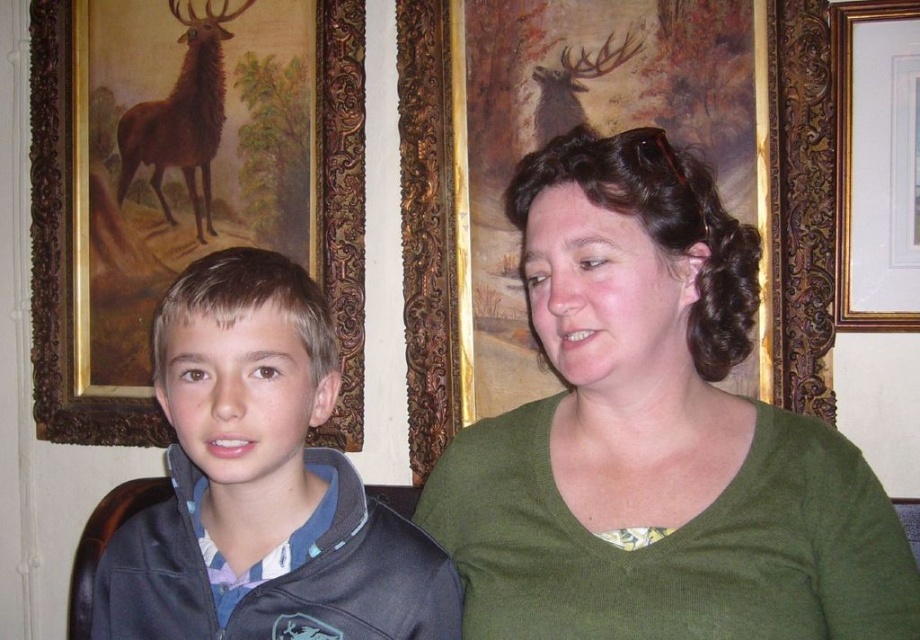
You are standing in front of a wall with framed artwork and two people sitting against it. You notice the blue plaid shirt at left and the gold ornate frame at upper right. Which object is positioned lower on the wall?

The blue plaid shirt at left is located below the gold ornate frame at upper right, so it is positioned lower on the wall.

What are the coordinates of the green matte shirt at center?

The green matte shirt at center is located at coordinates point (654, 436).